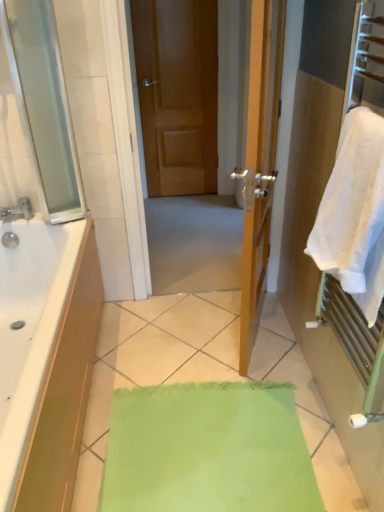
Identify the location of matte wooden door at center. Image resolution: width=384 pixels, height=512 pixels. (177, 93).

In order to face brushed metal faucet at left, should I rotate leftwards or rightwards?

It's best to rotate left around 23.959 degrees.

Find the location of a particular element. This screenshot has height=512, width=384. matte wooden door at center is located at coordinates (177, 93).

Find the location of `tap lying above the white fluffy towel at right (from the image's perspective)`. tap lying above the white fluffy towel at right (from the image's perspective) is located at coordinates (18, 210).

Can you confirm if white fluffy towel at right is wider than brushed metal faucet at left?

In fact, white fluffy towel at right might be narrower than brushed metal faucet at left.

Considering the sizes of objects white fluffy towel at right and brushed metal faucet at left in the image provided, who is shorter, white fluffy towel at right or brushed metal faucet at left?

Standing shorter between the two is brushed metal faucet at left.

From a real-world perspective, relative to brushed metal faucet at left, is white fluffy towel at right vertically above or below?

Clearly, from a real-world perspective, white fluffy towel at right is above brushed metal faucet at left.

Considering the sizes of matte wooden door at center and brushed metal faucet at left in the image, is matte wooden door at center wider or thinner than brushed metal faucet at left?

Considering their sizes, matte wooden door at center looks slimmer than brushed metal faucet at left.

Is point (186, 138) positioned behind point (3, 217)?

Yes, it is.

From a real-world perspective, which is physically above, matte wooden door at center or brushed metal faucet at left?

From a 3D spatial view, matte wooden door at center is above.

Is brushed metal faucet at left turned away from matte wooden door at center?

No, matte wooden door at center is not at the back of brushed metal faucet at left.

From a real-world perspective, is brushed metal faucet at left positioned under matte wooden door at center based on gravity?

Yes, from a real-world perspective, brushed metal faucet at left is beneath matte wooden door at center.

From the image's perspective, is brushed metal faucet at left located beneath matte wooden door at center?

Correct, brushed metal faucet at left appears lower than matte wooden door at center in the image.

Which point is more distant from viewer, (26, 199) or (331, 175)?

Positioned behind is point (26, 199).

Considering the sizes of objects brushed metal faucet at left and white fluffy towel at right in the image provided, who is shorter, brushed metal faucet at left or white fluffy towel at right?

brushed metal faucet at left.

From a real-world perspective, is brushed metal faucet at left located higher than white fluffy towel at right?

No, from a real-world perspective, brushed metal faucet at left is not on top of white fluffy towel at right.

Considering the relative sizes of white fluffy towel at right and matte wooden door at center in the image provided, is white fluffy towel at right shorter than matte wooden door at center?

Yes.

Is white fluffy towel at right oriented away from matte wooden door at center?

No, white fluffy towel at right is not facing the opposite direction of matte wooden door at center.

Considering the relative positions of white fluffy towel at right and matte wooden door at center in the image provided, is white fluffy towel at right to the left of matte wooden door at center from the viewer's perspective?

No.

From a real-world perspective, between white fluffy towel at right and matte wooden door at center, who is vertically lower?

From a 3D spatial view, matte wooden door at center is below.

Would you say matte wooden door at center is outside white fluffy towel at right?

Indeed, matte wooden door at center is completely outside white fluffy towel at right.

Considering the points (200, 45) and (372, 313), which point is behind, point (200, 45) or point (372, 313)?

The point (200, 45) is farther from the camera.

From the picture: Is matte wooden door at center aimed at white fluffy towel at right?

Yes, matte wooden door at center is aimed at white fluffy towel at right.

Is matte wooden door at center bigger than white fluffy towel at right?

Yes.

In order to click on towel above the brushed metal faucet at left (from a real-world perspective) in this screenshot , I will do `click(354, 213)`.

This screenshot has width=384, height=512. I want to click on tap on the left of matte wooden door at center, so click(x=18, y=210).

When comparing their distances from brushed metal faucet at left, does matte wooden door at center or white fluffy towel at right seem further?

Among the two, matte wooden door at center is located further to brushed metal faucet at left.

When comparing their distances from matte wooden door at center, does white fluffy towel at right or brushed metal faucet at left seem closer?

Result: brushed metal faucet at left is closer to matte wooden door at center.

Based on their spatial positions, is brushed metal faucet at left or matte wooden door at center closer to white fluffy towel at right?

brushed metal faucet at left lies closer to white fluffy towel at right than the other object.

Looking at the image, which one is located closer to matte wooden door at center, brushed metal faucet at left or white fluffy towel at right?

brushed metal faucet at left is positioned closer to the anchor matte wooden door at center.

Which object lies nearer to the anchor point white fluffy towel at right, matte wooden door at center or brushed metal faucet at left?

Based on the image, brushed metal faucet at left appears to be nearer to white fluffy towel at right.

From the image, which object appears to be farther from brushed metal faucet at left, white fluffy towel at right or matte wooden door at center?

matte wooden door at center is positioned further to the anchor brushed metal faucet at left.

Identify the location of tap between white fluffy towel at right and matte wooden door at center from front to back. This screenshot has height=512, width=384. (18, 210).